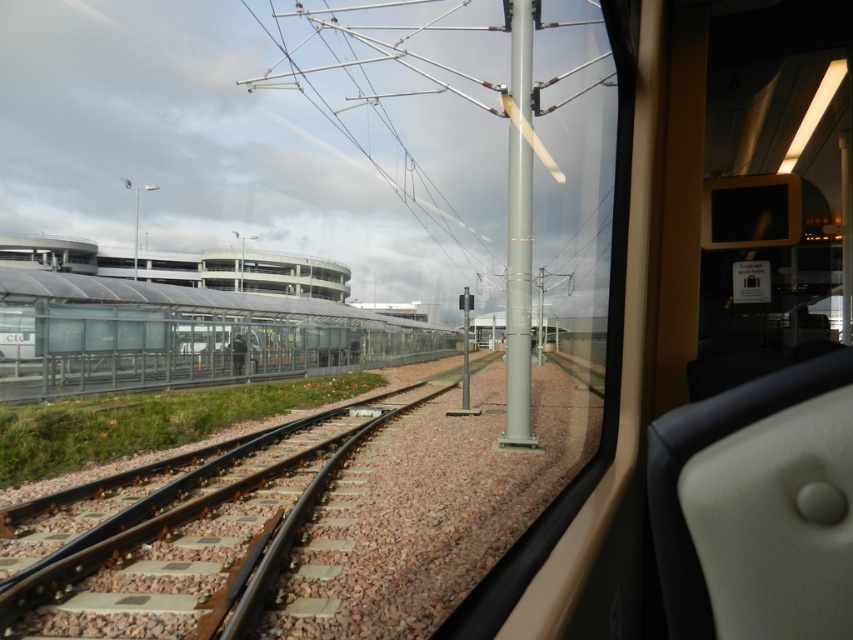
Between transparent glass train at left and metallic gray pole at center, which one appears on the right side from the viewer's perspective?

metallic gray pole at center is more to the right.

Is point (20, 380) in front of point (515, 412)?

That is False.

Where is `transparent glass train at left`? This screenshot has height=640, width=853. transparent glass train at left is located at coordinates (183, 336).

Does transparent glass train window at center appear on the right side of transparent glass train at left?

Indeed, transparent glass train window at center is positioned on the right side of transparent glass train at left.

Between transparent glass train window at center and transparent glass train at left, which one appears on the left side from the viewer's perspective?

Positioned to the left is transparent glass train at left.

Is point (790, 499) behind point (10, 348)?

No, it is not.

At what (x,y) coordinates should I click in order to perform the action: click on transparent glass train window at center. Please return your answer as a coordinate pair (x, y). This screenshot has height=640, width=853. Looking at the image, I should click on (706, 368).

Does transparent glass train window at center have a larger size compared to metallic gray pole at center?

No.

From the picture: Which of these two, transparent glass train window at center or metallic gray pole at center, stands shorter?

transparent glass train window at center is shorter.

Identify the location of transparent glass train window at center. (706, 368).